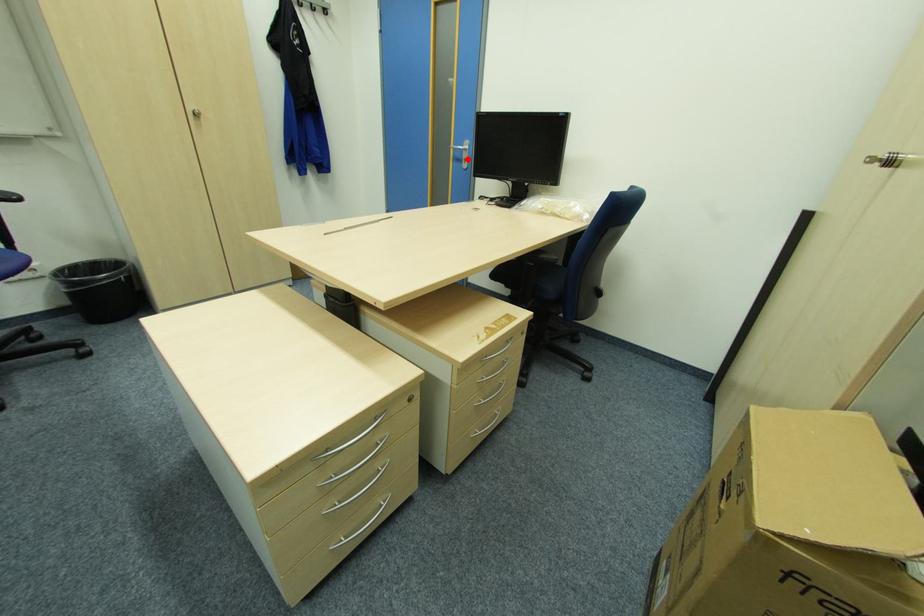
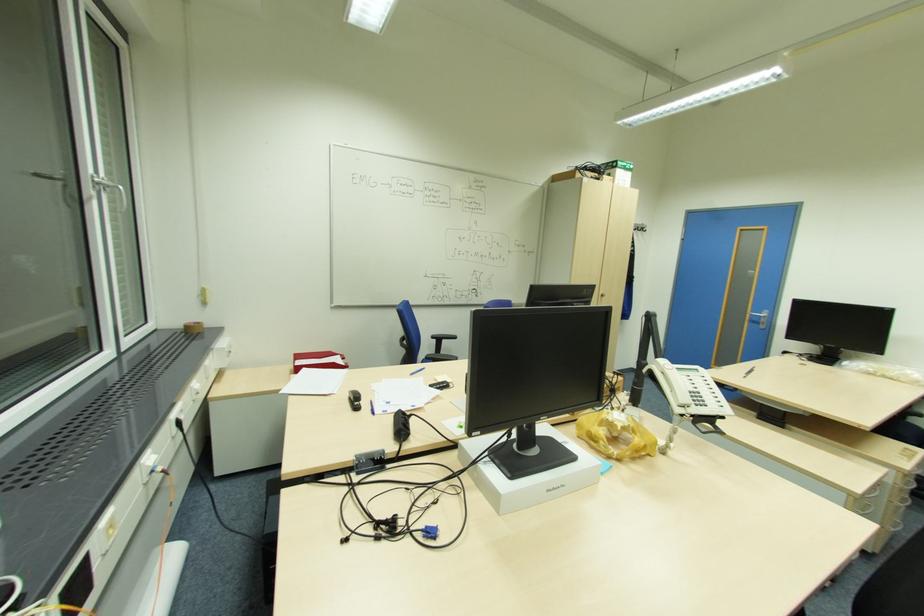
Question: A red point is marked in image1. In image2, is the corresponding 3D point closer to the camera or farther? Reply with the corresponding letter.

Choices:
 (A) The corresponding 3D point is closer.
 (B) The corresponding 3D point is farther.

Answer: (B)